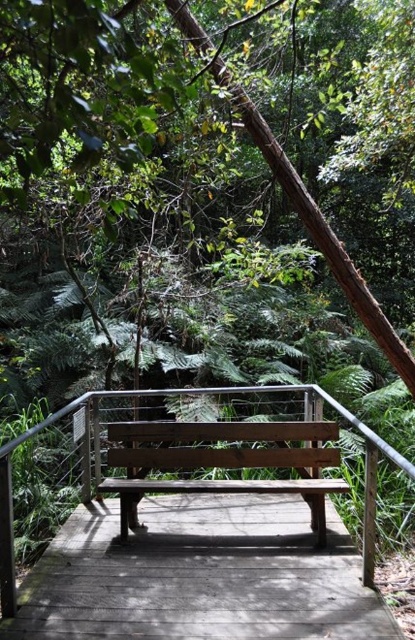
In the scene shown: Does weathered wood bench at center have a smaller size compared to wooden bench at center?

Yes.

Between weathered wood bench at center and wooden bench at center, which one has less height?

weathered wood bench at center

Find the location of `weathered wood bench at center`. weathered wood bench at center is located at coordinates (200, 576).